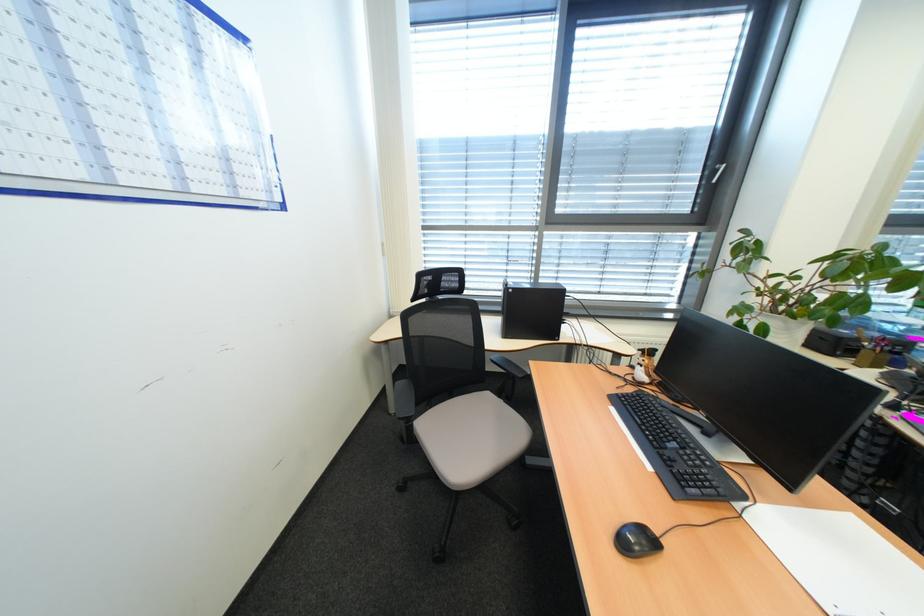
The height and width of the screenshot is (616, 924). What do you see at coordinates (716, 172) in the screenshot? I see `a silver window handle` at bounding box center [716, 172].